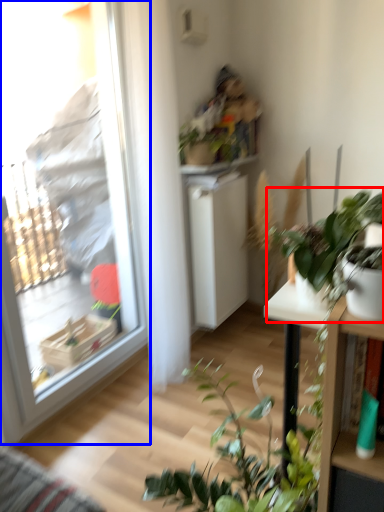
Question: Which object is further to the camera taking this photo, houseplant (highlighted by a red box) or window (highlighted by a blue box)?

Choices:
 (A) houseplant
 (B) window

Answer: (B)